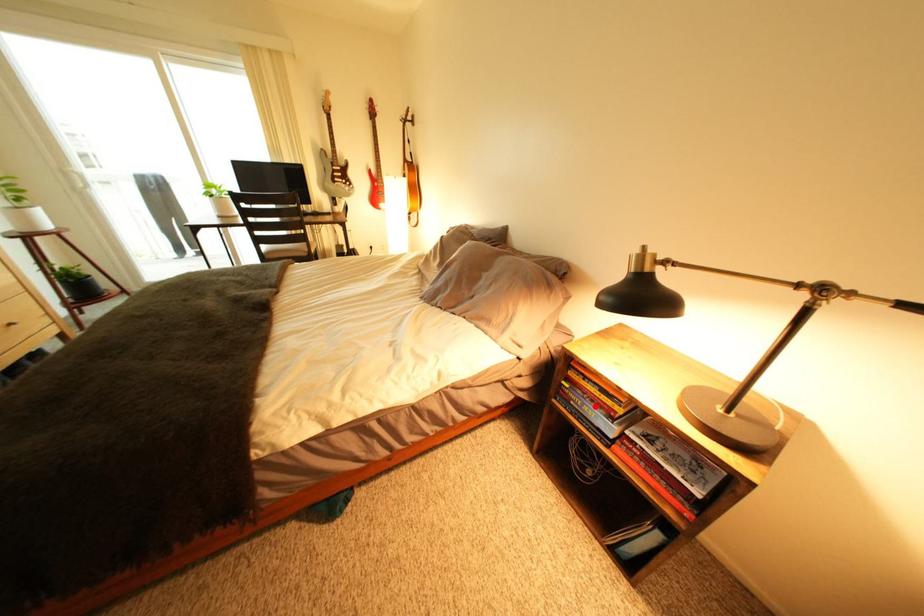
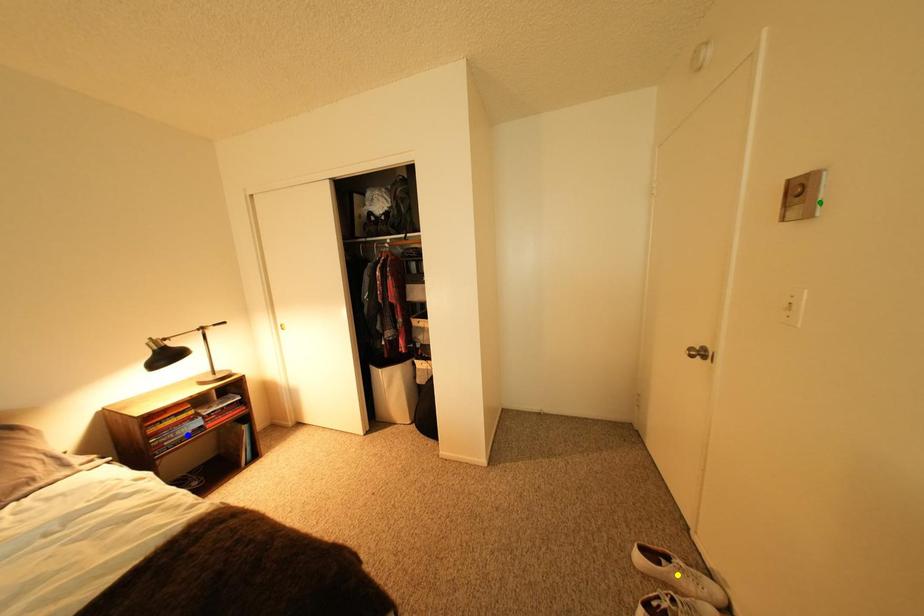
Question: I am providing you with two images of the same scene from different viewpoints. A red point is marked on the first image. You are given multiple points on the second image. Which point in image 2 represents the same 3d spot as the red point in image 1?

Choices:
 (A) green point
 (B) blue point
 (C) yellow point

Answer: (B)